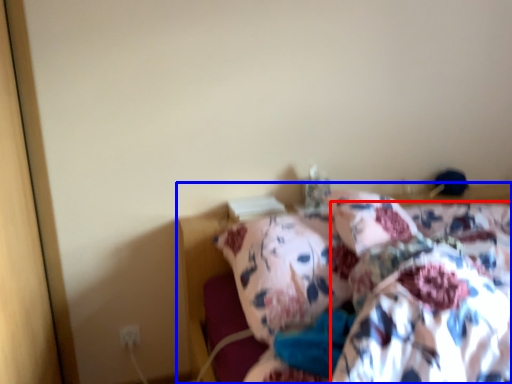
Question: Which object is further to the camera taking this photo, blanket (highlighted by a red box) or bed (highlighted by a blue box)?

Choices:
 (A) blanket
 (B) bed

Answer: (A)